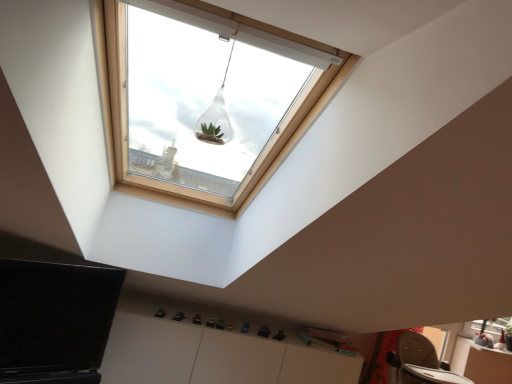
Locate an element on the screen. white matte cabinet at lower center is located at coordinates (213, 356).

This screenshot has width=512, height=384. Describe the element at coordinates (213, 356) in the screenshot. I see `white matte cabinet at lower center` at that location.

What are the coordinates of `transparent glass terrarium at upper center` in the screenshot? It's located at (217, 112).

Measure the distance between point [201,116] and camera.

10.54 feet.

Describe the element at coordinates (217, 112) in the screenshot. I see `transparent glass terrarium at upper center` at that location.

What is the approximate height of transparent glass terrarium at upper center?

The height of transparent glass terrarium at upper center is 35.15 centimeters.

This screenshot has height=384, width=512. I want to click on white matte cabinet at lower center, so click(213, 356).

Can you confirm if transparent glass terrarium at upper center is positioned to the left of white matte cabinet at lower center?

No, transparent glass terrarium at upper center is not to the left of white matte cabinet at lower center.

Is the depth of transparent glass terrarium at upper center less than that of white matte cabinet at lower center?

Yes, transparent glass terrarium at upper center is closer to the viewer.

Which is less distant, [198,124] or [119,337]?

The point [119,337] is in front.

From the image's perspective, is transparent glass terrarium at upper center over white matte cabinet at lower center?

Indeed, from the image's perspective, transparent glass terrarium at upper center is shown above white matte cabinet at lower center.

From a real-world perspective, between transparent glass terrarium at upper center and white matte cabinet at lower center, who is vertically higher?

In real-world perspective, transparent glass terrarium at upper center is above.

Looking at their sizes, would you say transparent glass terrarium at upper center is wider or thinner than white matte cabinet at lower center?

→ Clearly, transparent glass terrarium at upper center has less width compared to white matte cabinet at lower center.

Which of these two, transparent glass terrarium at upper center or white matte cabinet at lower center, stands taller?

With more height is white matte cabinet at lower center.

Looking at the image, does transparent glass terrarium at upper center seem bigger or smaller compared to white matte cabinet at lower center?

In the image, transparent glass terrarium at upper center appears to be smaller than white matte cabinet at lower center.

Is white matte cabinet at lower center located within transparent glass terrarium at upper center?

No, white matte cabinet at lower center is not a part of transparent glass terrarium at upper center.

Would you say transparent glass terrarium at upper center is a long distance from white matte cabinet at lower center?

Yes.

Is transparent glass terrarium at upper center looking in the opposite direction of white matte cabinet at lower center?

transparent glass terrarium at upper center does not have its back to white matte cabinet at lower center.

How different are the orientations of transparent glass terrarium at upper center and white matte cabinet at lower center in degrees?

They differ by 177 degrees in their facing directions.

How much distance is there between transparent glass terrarium at upper center and white matte cabinet at lower center?

transparent glass terrarium at upper center is 1.51 meters from white matte cabinet at lower center.

At what (x,y) coordinates should I click in order to perform the action: click on light fixture in front of the white matte cabinet at lower center. Please return your answer as a coordinate pair (x, y). The width and height of the screenshot is (512, 384). Looking at the image, I should click on (217, 112).

In the image, is white matte cabinet at lower center on the left side or the right side of transparent glass terrarium at upper center?

Clearly, white matte cabinet at lower center is on the left of transparent glass terrarium at upper center in the image.

Does white matte cabinet at lower center lie behind transparent glass terrarium at upper center?

Yes, the depth of white matte cabinet at lower center is greater than that of transparent glass terrarium at upper center.

Between point (141, 363) and point (227, 117), which one is positioned behind?

The point (227, 117) is farther.

From the image's perspective, between white matte cabinet at lower center and transparent glass terrarium at upper center, who is located below?

From the image's view, white matte cabinet at lower center is below.

From a real-world perspective, is white matte cabinet at lower center below transparent glass terrarium at upper center?

Yes.

Does white matte cabinet at lower center have a lesser width compared to transparent glass terrarium at upper center?

No.

Is white matte cabinet at lower center shorter than transparent glass terrarium at upper center?

No, white matte cabinet at lower center is not shorter than transparent glass terrarium at upper center.

Is white matte cabinet at lower center bigger than transparent glass terrarium at upper center?

Yes.

Is white matte cabinet at lower center located outside transparent glass terrarium at upper center?

Indeed, white matte cabinet at lower center is completely outside transparent glass terrarium at upper center.

Is white matte cabinet at lower center far away from transparent glass terrarium at upper center?

Absolutely, white matte cabinet at lower center is distant from transparent glass terrarium at upper center.

From the picture: Is white matte cabinet at lower center aimed at transparent glass terrarium at upper center?

No, white matte cabinet at lower center is not aimed at transparent glass terrarium at upper center.

Where is `cabinetry behind the transparent glass terrarium at upper center`? The height and width of the screenshot is (384, 512). cabinetry behind the transparent glass terrarium at upper center is located at coordinates (213, 356).

At what (x,y) coordinates should I click in order to perform the action: click on light fixture above the white matte cabinet at lower center (from a real-world perspective). Please return your answer as a coordinate pair (x, y). The width and height of the screenshot is (512, 384). Looking at the image, I should click on (x=217, y=112).

This screenshot has height=384, width=512. What are the coordinates of `cabinetry beneath the transparent glass terrarium at upper center (from a real-world perspective)` in the screenshot? It's located at (213, 356).